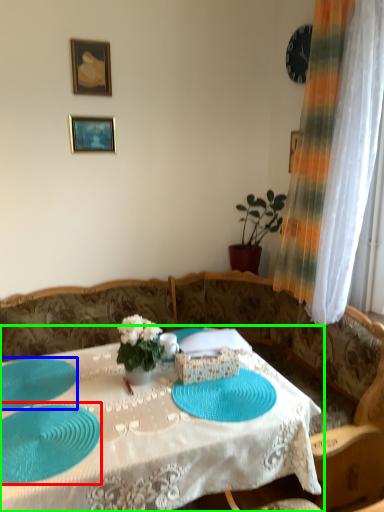
Question: Based on their relative distances, which object is farther from glass plate (highlighted by a red box)? Choose from glass plate (highlighted by a blue box) and table (highlighted by a green box).

Choices:
 (A) glass plate
 (B) table

Answer: (B)